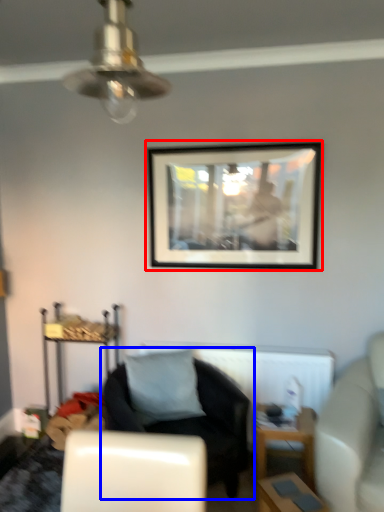
Question: Which point is closer to the camera, picture frame (highlighted by a red box) or chair (highlighted by a blue box)?

Choices:
 (A) picture frame
 (B) chair

Answer: (B)